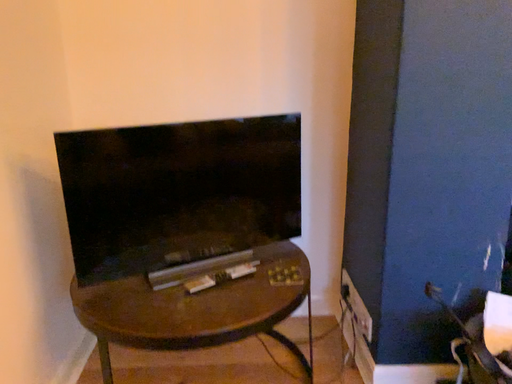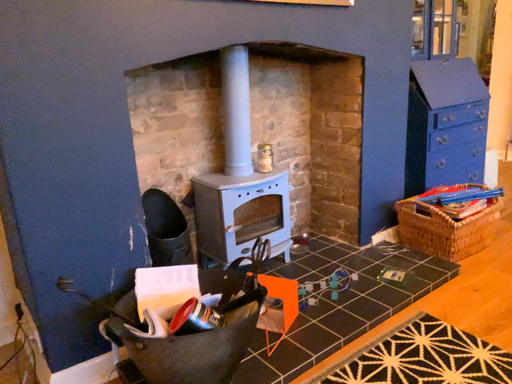
Question: How did the camera likely rotate when shooting the video?

Choices:
 (A) rotated right
 (B) rotated left

Answer: (A)